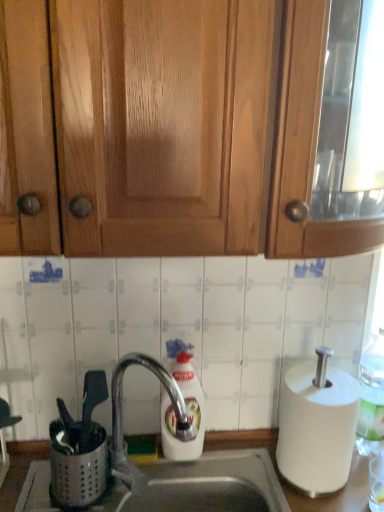
Question: In terms of height, does satin chrome faucet at center look taller or shorter compared to wooden cabinet at upper center?

Choices:
 (A) short
 (B) tall

Answer: (A)

Question: Considering their positions, is satin chrome faucet at center located in front of or behind wooden cabinet at upper center?

Choices:
 (A) front
 (B) behind

Answer: (B)

Question: Estimate the real-world distances between objects in this image. Which object is farther from the white matte paper towel at right?

Choices:
 (A) white plastic bottle at right
 (B) metallic stainless steel sink at lower center
 (C) wooden cabinet at upper center
 (D) satin chrome faucet at center
 (E) white glossy soap dispenser at center

Answer: (C)

Question: Based on their relative distances, which object is farther from the white matte paper towel at right?

Choices:
 (A) white plastic bottle at right
 (B) wooden cabinet at upper center
 (C) satin chrome faucet at center
 (D) white glossy soap dispenser at center
 (E) metallic stainless steel sink at lower center

Answer: (B)